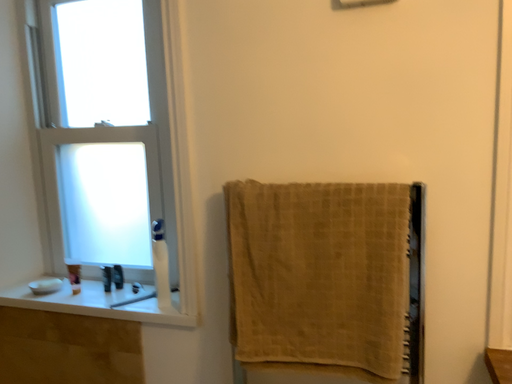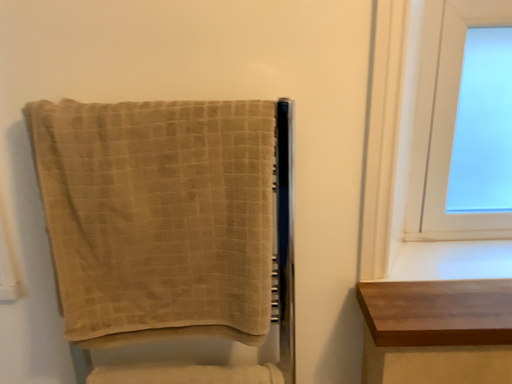
Question: Which way did the camera rotate in the video?

Choices:
 (A) rotated right
 (B) rotated left

Answer: (A)